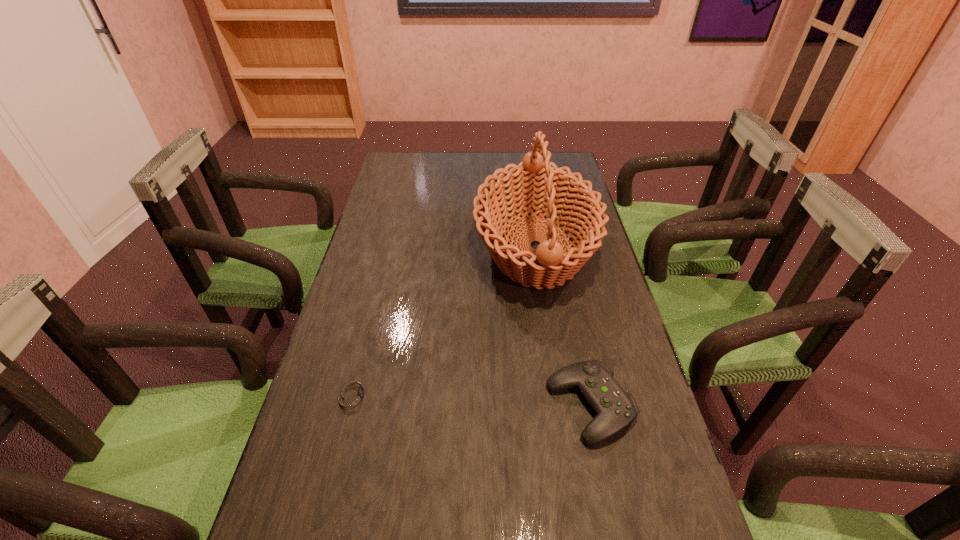
Image resolution: width=960 pixels, height=540 pixels. Identify the location of the second closest object relative to the shortest object. (615, 408).

I want to click on vacant position in the image that satisfies the following two spatial constraints: 1. on the face of the watch; 2. on the right side of the second tallest object, so click(350, 406).

You are a GUI agent. You are given a task and a screenshot of the screen. Output one action in this format:
    pyautogui.click(x=<x>, y=<y>)
    Task: Click on the free space that satisfies the following two spatial constraints: 1. on the front side of the second shortest object; 2. on the right side of the basket
    The height and width of the screenshot is (540, 960).
    Given the screenshot: What is the action you would take?
    pyautogui.click(x=560, y=406)

Find the location of a particular element. This screenshot has width=960, height=540. vacant space that satisfies the following two spatial constraints: 1. on the front side of the basket; 2. on the face of the leftmost object is located at coordinates (558, 394).

Where is `free space that satisfies the following two spatial constraints: 1. on the face of the leftmost object; 2. on the left side of the control`? The height and width of the screenshot is (540, 960). free space that satisfies the following two spatial constraints: 1. on the face of the leftmost object; 2. on the left side of the control is located at coordinates (350, 406).

Locate an element on the screen. The width and height of the screenshot is (960, 540). blank space that satisfies the following two spatial constraints: 1. on the face of the watch; 2. on the back side of the second tallest object is located at coordinates (350, 406).